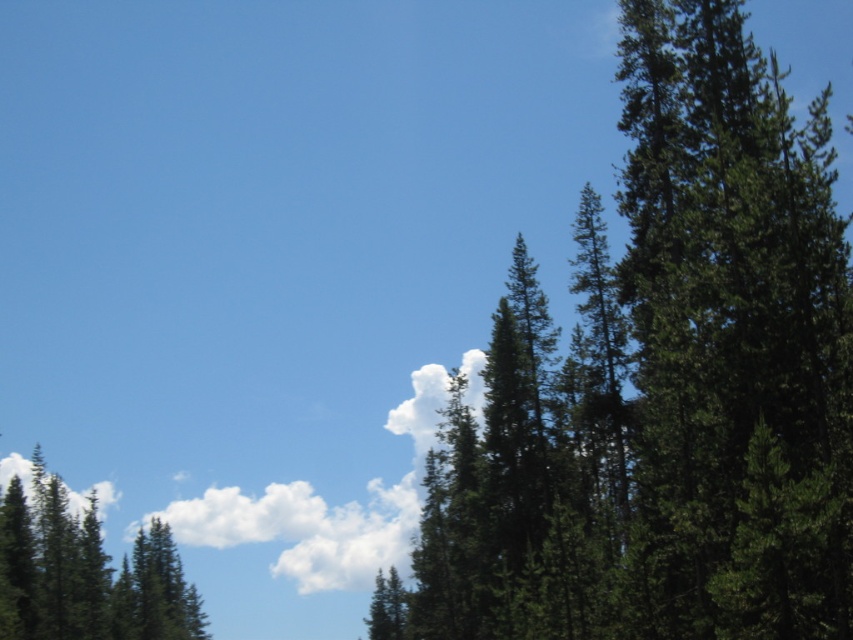
Question: Does green textured pine trees at upper right appear on the left side of green matte tree at lower left?

Choices:
 (A) yes
 (B) no

Answer: (B)

Question: Which point appears closest to the camera in this image?

Choices:
 (A) (21, 548)
 (B) (598, 220)

Answer: (B)

Question: Does green textured pine trees at upper right have a smaller size compared to green matte tree at lower left?

Choices:
 (A) yes
 (B) no

Answer: (B)

Question: Observing the image, what is the correct spatial positioning of green textured pine trees at upper right in reference to green matte tree at lower left?

Choices:
 (A) left
 (B) right

Answer: (B)

Question: Which object is farther from the camera taking this photo?

Choices:
 (A) green matte tree at lower left
 (B) green textured pine trees at upper right

Answer: (A)